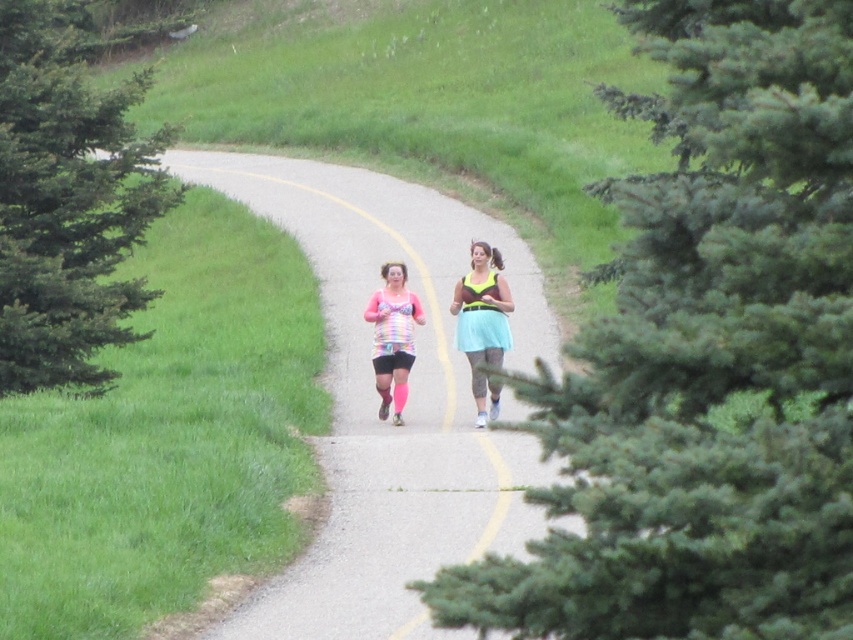
Is smooth asphalt road at center wider than green needle-like pine at left?

Indeed, smooth asphalt road at center has a greater width compared to green needle-like pine at left.

The width and height of the screenshot is (853, 640). I want to click on smooth asphalt road at center, so click(x=379, y=401).

Identify the location of smooth asphalt road at center. Image resolution: width=853 pixels, height=640 pixels. (379, 401).

Is point (106, 305) farther from viewer compared to point (390, 364)?

Yes, point (106, 305) is behind point (390, 364).

Does green needle-like pine at left appear under rainbow fabric tank top at center?

No, green needle-like pine at left is not below rainbow fabric tank top at center.

You are a GUI agent. You are given a task and a screenshot of the screen. Output one action in this format:
    pyautogui.click(x=<x>, y=<y>)
    Task: Click on the green needle-like pine at left
    
    Given the screenshot: What is the action you would take?
    pyautogui.click(x=67, y=202)

Measure the distance between green textured pine at center right and rainbow fabric tank top at center.

They are 4.59 meters apart.

Which of these two, green textured pine at center right or rainbow fabric tank top at center, stands shorter?

Standing shorter between the two is rainbow fabric tank top at center.

Is point (733, 68) positioned behind point (404, 374)?

No.

Find the location of a particular element. The height and width of the screenshot is (640, 853). green textured pine at center right is located at coordinates (704, 358).